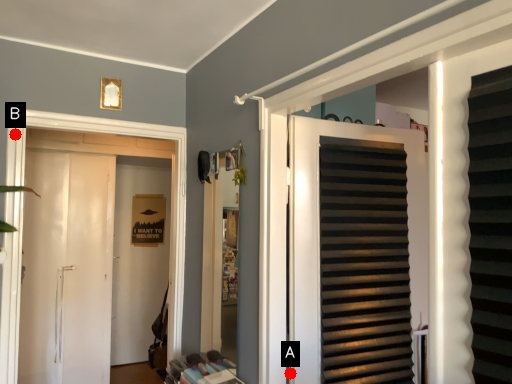
Question: Two points are circled on the image, labeled by A and B beside each circle. Among these points, which one is nearest to the camera?

Choices:
 (A) A is closer
 (B) B is closer

Answer: (A)